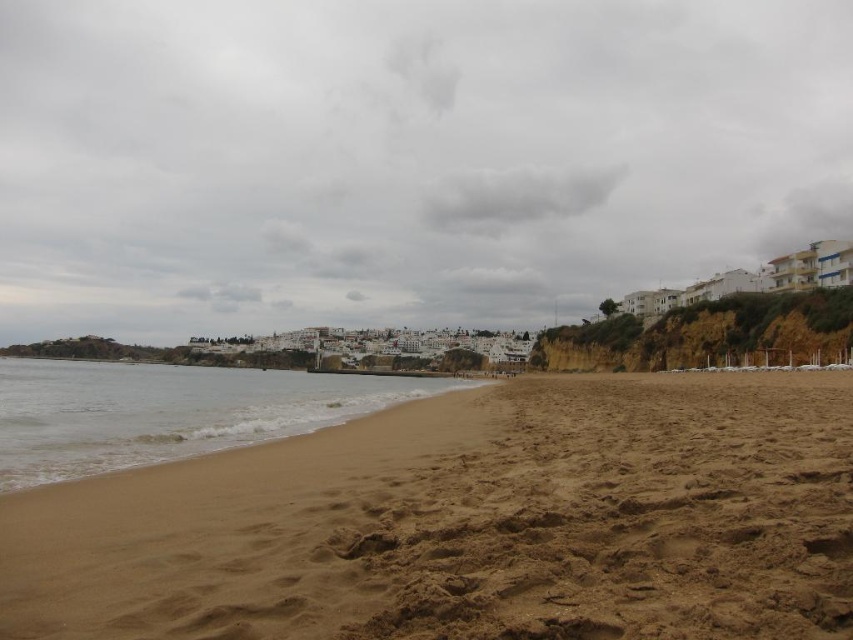
You are standing at the shoreline on the beach and want to reach a treasure chest buried at point (26, 241). There is a large rock blocking your path at point (109, 410). Can you walk directly to the treasure chest without going around the rock?

Point (26, 241) is behind point (109, 410), so the rock at (109, 410) is between you and the treasure chest. You will need to go around the rock to reach the treasure chest.

You are standing on the beach looking towards the ocean. Which object, the cloudy sky at upper center or the brown sand at lower left, is located to the right side of the other?

The cloudy sky at upper center is positioned on the right side of brown sand at lower left.